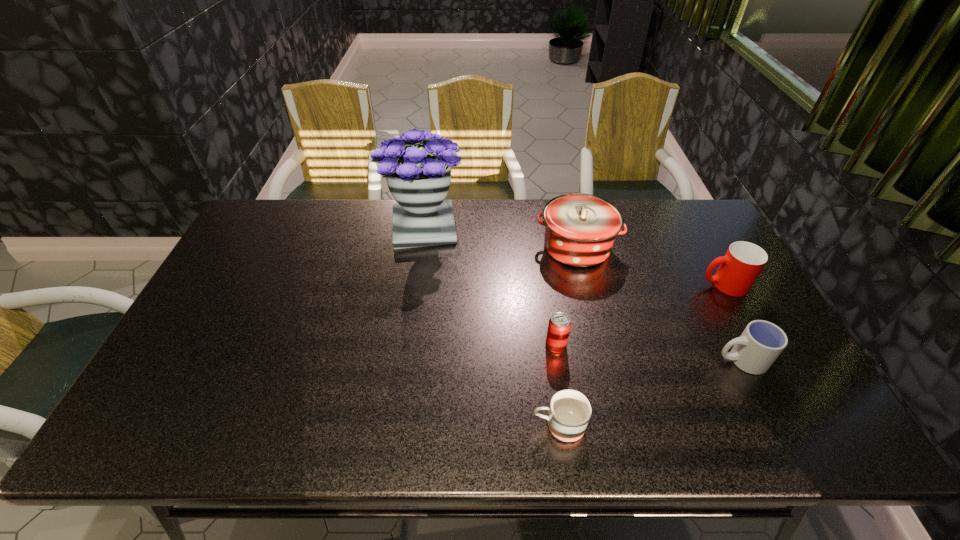
At what (x,y) coordinates should I click in order to perform the action: click on bouquet. Please return your answer as a coordinate pair (x, y). The width and height of the screenshot is (960, 540). Looking at the image, I should click on (418, 176).

The width and height of the screenshot is (960, 540). In order to click on the tallest object in this screenshot , I will do `click(418, 176)`.

Image resolution: width=960 pixels, height=540 pixels. Find the location of `casserole`. casserole is located at coordinates (580, 229).

I want to click on the fourth shortest object, so click(739, 268).

Where is `the farther cup`? The height and width of the screenshot is (540, 960). the farther cup is located at coordinates (739, 268).

In order to click on the nearer cup in this screenshot , I will do `click(761, 342)`.

Find the location of a particular element. The height and width of the screenshot is (540, 960). can is located at coordinates (559, 326).

Where is `the shortest object`? the shortest object is located at coordinates click(x=570, y=411).

Identify the location of the nearest object. (570, 411).

Locate an element on the screen. This screenshot has width=960, height=540. free spot located 0.110m on the front of the leftmost object is located at coordinates (417, 279).